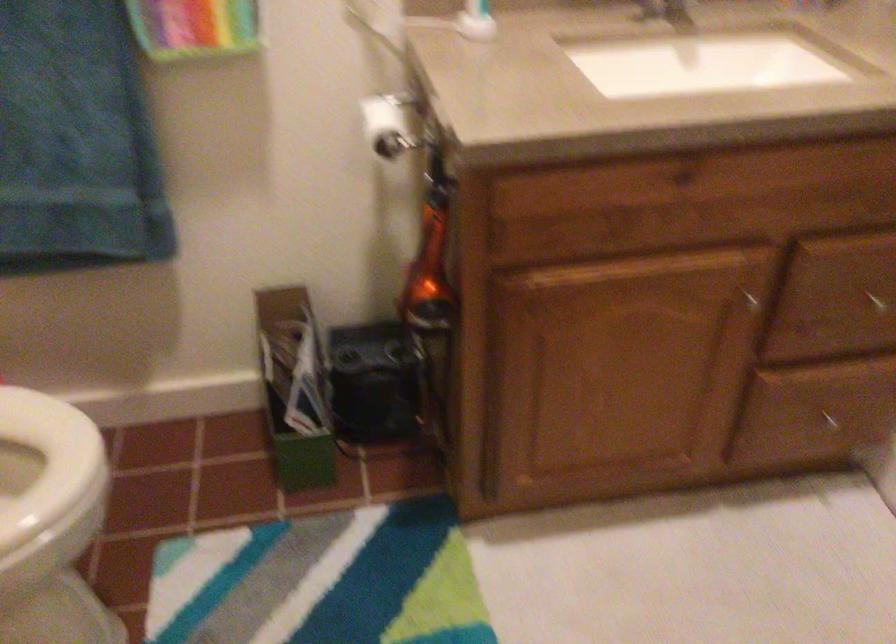
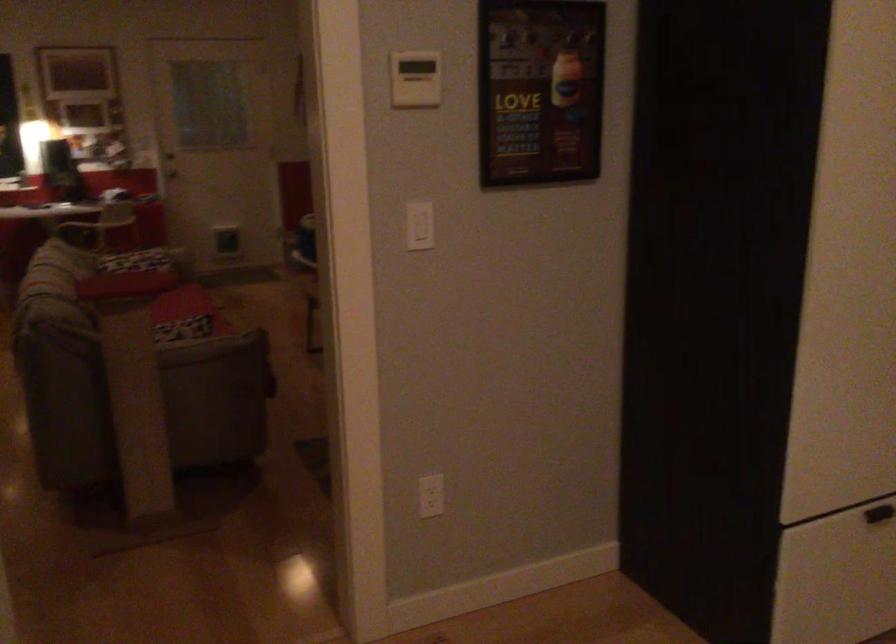
Based on the continuous images, in which direction is the camera rotating?

The camera rotated toward right-down.